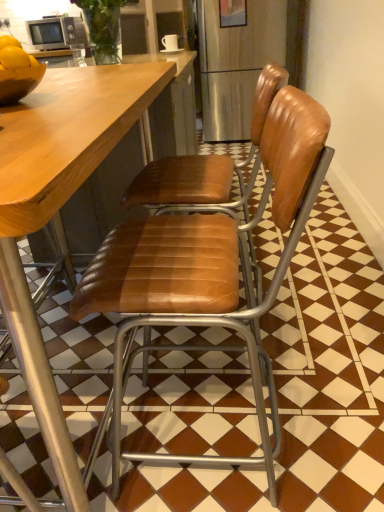
This screenshot has width=384, height=512. Identify the location of free area below shiny brown bowl at left (from a real-world perspective). (79, 389).